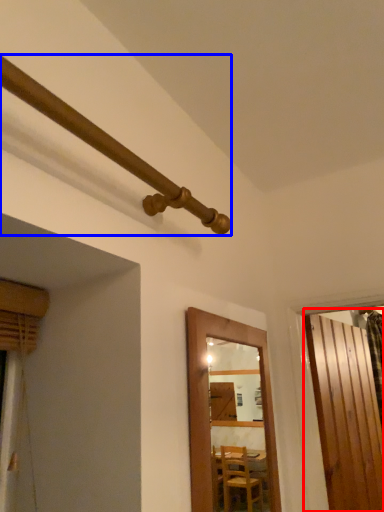
Question: Which object appears farthest to the camera in this image, door (highlighted by a red box) or pipe (highlighted by a blue box)?

Choices:
 (A) door
 (B) pipe

Answer: (A)